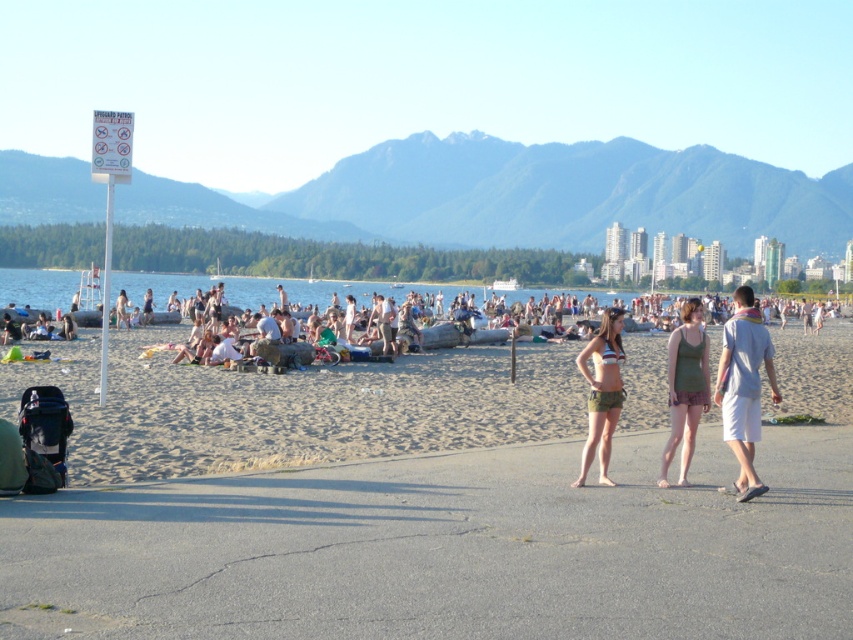
Consider the image. You are a photographer trying to capture a candid shot of the beach scene. You notice the green fabric bikini bottom at center and the black fabric baby carriage at lower left. Which object should you focus on to ensure it appears in the foreground of your photo?

The black fabric baby carriage at lower left should be focused on to appear in the foreground because it is located below the green fabric bikini bottom at center, making it closer to the camera.

You are a photographer standing at the edge of the sandy beach at center and want to take a picture of the light blue cotton shirt at center. Based on their positions, which object should be placed to the left in the photo?

The sandy beach at center is positioned on the left side of light blue cotton shirt at center, so in the photo, the sandy beach at center should be placed to the left of the light blue cotton shirt at center.

You are a photographer standing on the sandy beach at center and want to take a photo of the light blue cotton shirt at center. Which object should be in the foreground of your photo?

The sandy beach at center should be in the foreground of the photo because it is located below the light blue cotton shirt at center, placing it closer to the camera.